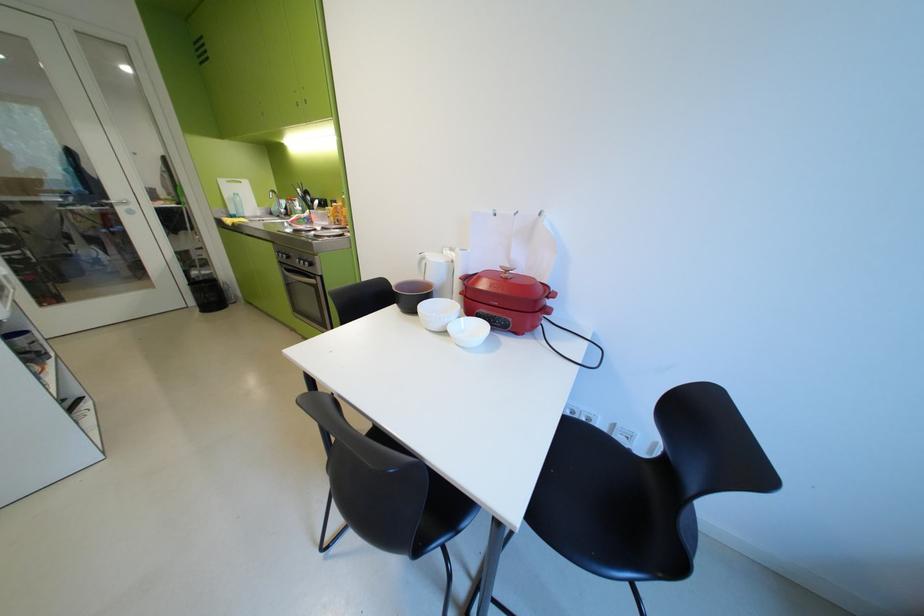
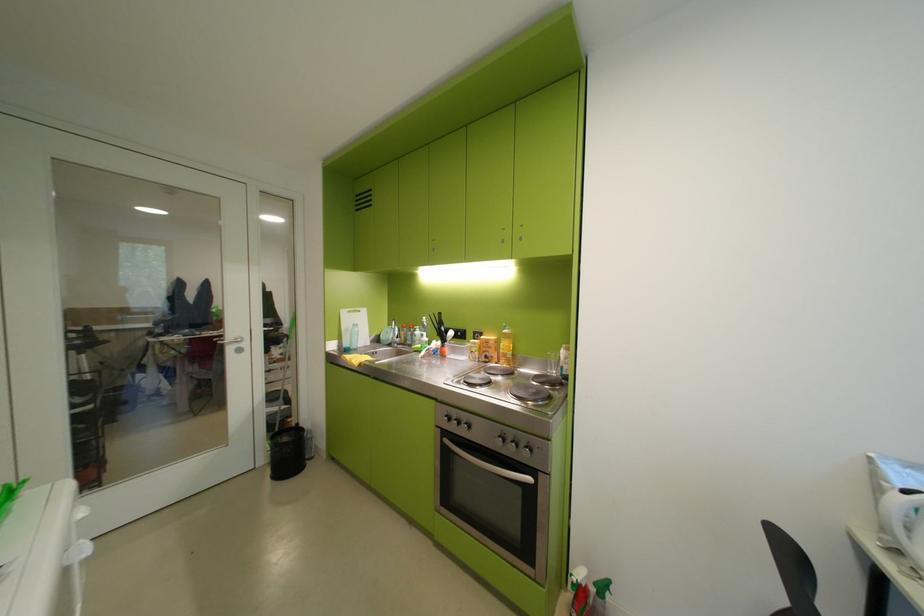
Locate, in the second image, the point that corresponds to point (122, 207) in the first image.

(233, 346)